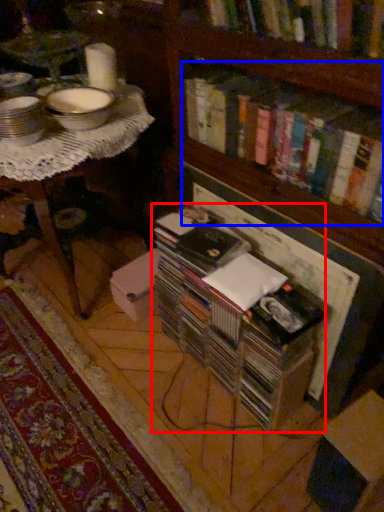
Question: Which object is further to the camera taking this photo, book (highlighted by a red box) or book (highlighted by a blue box)?

Choices:
 (A) book
 (B) book

Answer: (A)